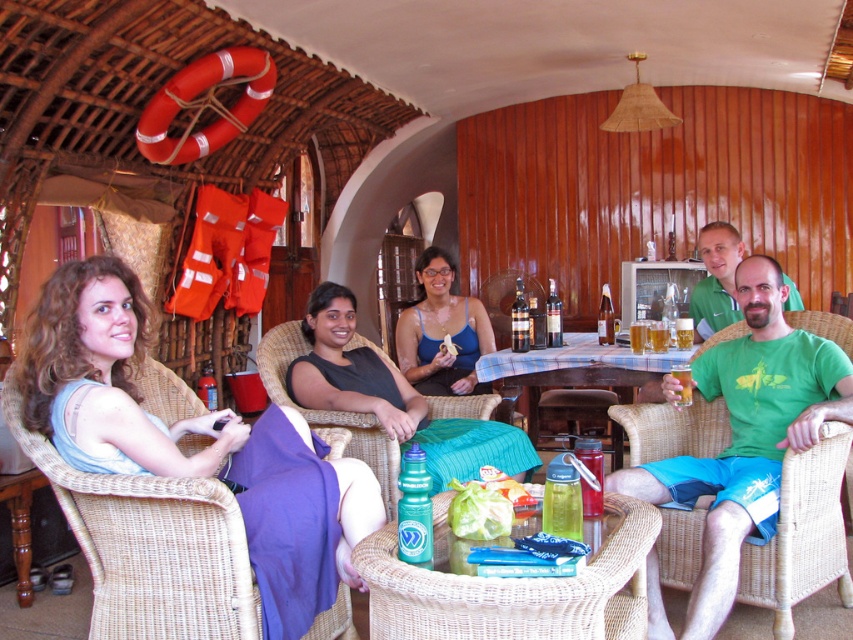
From the picture: Between green cotton t-shirt at right and translucent glass beer at table center, which one appears on the right side from the viewer's perspective?

Positioned to the right is green cotton t-shirt at right.

Is green cotton t-shirt at right to the right of translucent glass beer at table center from the viewer's perspective?

Yes, green cotton t-shirt at right is to the right of translucent glass beer at table center.

Does point (770, 532) come farther from viewer compared to point (630, 346)?

No, (770, 532) is in front of (630, 346).

In order to click on green cotton t-shirt at right in this screenshot , I will do `click(747, 435)`.

Does matte blue tank top at center have a lesser width compared to clear plastic bottle at center?

No.

Looking at this image, is matte blue tank top at center closer to the viewer compared to clear plastic bottle at center?

No, it is behind clear plastic bottle at center.

Which is behind, point (428, 387) or point (598, 499)?

The point (428, 387) is more distant.

The width and height of the screenshot is (853, 640). I want to click on matte blue tank top at center, so click(x=440, y=332).

Does green cotton t-shirt at right have a larger size compared to matte blue tank top at center?

Yes.

Is green cotton t-shirt at right behind matte blue tank top at center?

No, it is in front of matte blue tank top at center.

Is point (747, 442) positioned before point (466, 390)?

Yes, it is in front of point (466, 390).

The image size is (853, 640). I want to click on green cotton t-shirt at right, so click(747, 435).